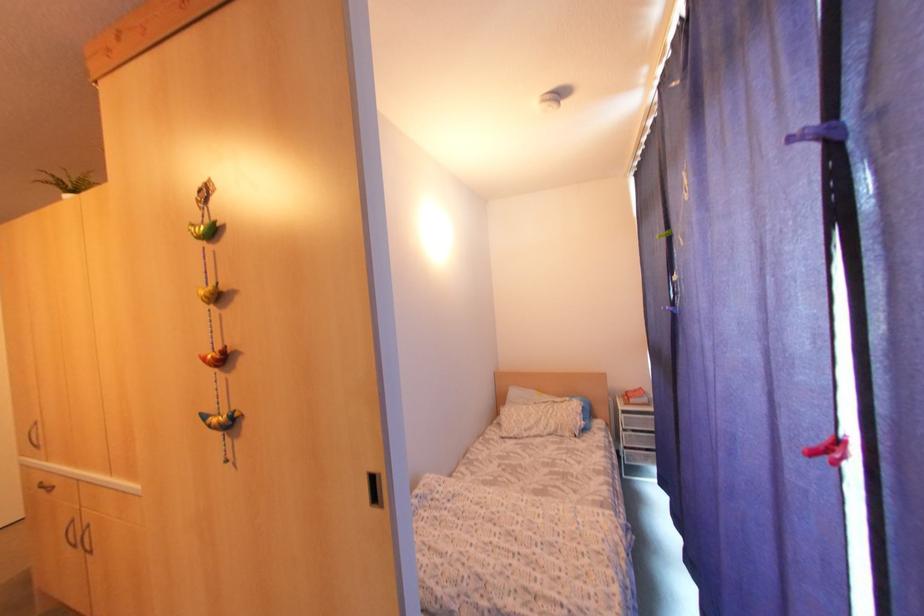
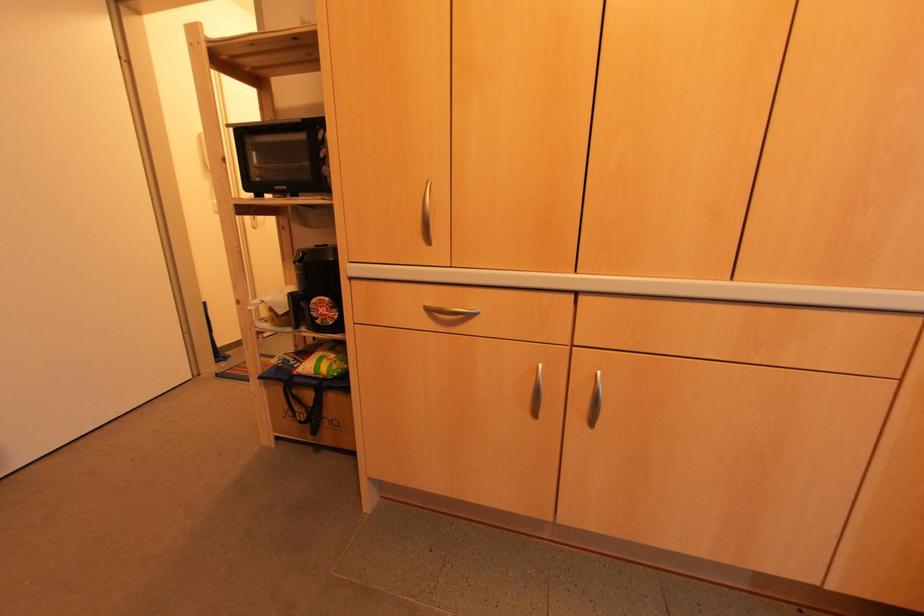
The images are taken continuously from a first-person perspective. In which direction are you moving?

The movement direction of the cameraman is left, forward.